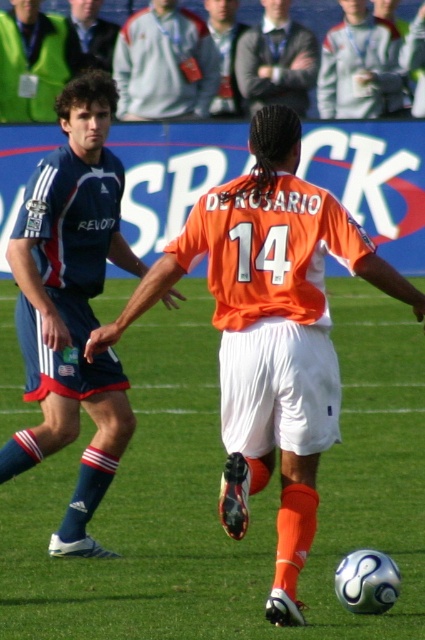
Does smooth gray suit at upper center come behind dark gray jacket at upper center?

No, smooth gray suit at upper center is closer to the viewer.

Who is lower down, smooth gray suit at upper center or dark gray jacket at upper center?

smooth gray suit at upper center

Is point (266, 83) more distant than point (207, 12)?

No, (266, 83) is in front of (207, 12).

Find the location of `smooth gray suit at upper center`. smooth gray suit at upper center is located at coordinates (277, 60).

Is blue fabric shorts at left to the left of matte blue jersey at left from the viewer's perspective?

No, blue fabric shorts at left is not to the left of matte blue jersey at left.

Is blue fabric shorts at left wider than matte blue jersey at left?

No.

Does point (85, 340) come closer to viewer compared to point (50, 84)?

That is True.

Where is `blue fabric shorts at left`? The width and height of the screenshot is (425, 640). blue fabric shorts at left is located at coordinates (71, 305).

Measure the distance between green grass at center and green matte vest at upper left.

green grass at center and green matte vest at upper left are 6.88 meters apart from each other.

Between green grass at center and green matte vest at upper left, which one appears on the right side from the viewer's perspective?

From the viewer's perspective, green grass at center appears more on the right side.

Between point (127, 282) and point (81, 58), which one is positioned behind?

The point (81, 58) is more distant.

At what (x,y) coordinates should I click in order to perform the action: click on green grass at center. Please return your answer as a coordinate pair (x, y). Looking at the image, I should click on (217, 496).